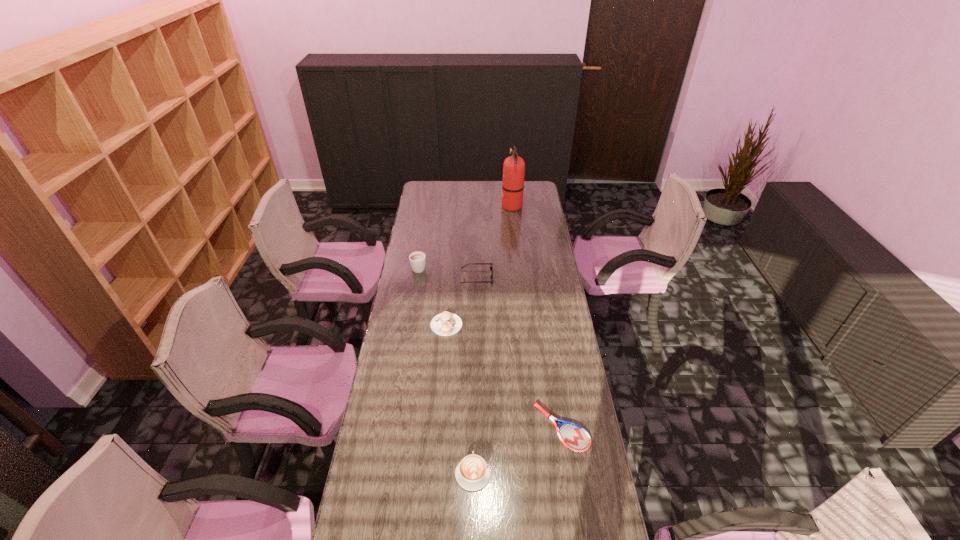
Identify the location of the tallest object. The width and height of the screenshot is (960, 540). (514, 166).

At what (x,y) coordinates should I click in order to perform the action: click on fire extinguisher. Please return your answer as a coordinate pair (x, y). This screenshot has width=960, height=540. Looking at the image, I should click on (514, 166).

What are the coordinates of `the farthest cappuccino` in the screenshot? It's located at (417, 259).

Find the location of a particular element. The width and height of the screenshot is (960, 540). the leftmost object is located at coordinates (417, 259).

What are the coordinates of `the fourth shortest object` in the screenshot? It's located at (491, 267).

Identify the location of the second shortest cappuccino. (472, 473).

Locate an element on the screen. This screenshot has height=540, width=960. the nearest cappuccino is located at coordinates (472, 473).

Locate an element on the screen. This screenshot has width=960, height=540. the shortest cappuccino is located at coordinates (445, 324).

I want to click on the fourth farthest object, so (x=445, y=324).

Where is `the second nearest object`? Image resolution: width=960 pixels, height=540 pixels. the second nearest object is located at coordinates (573, 436).